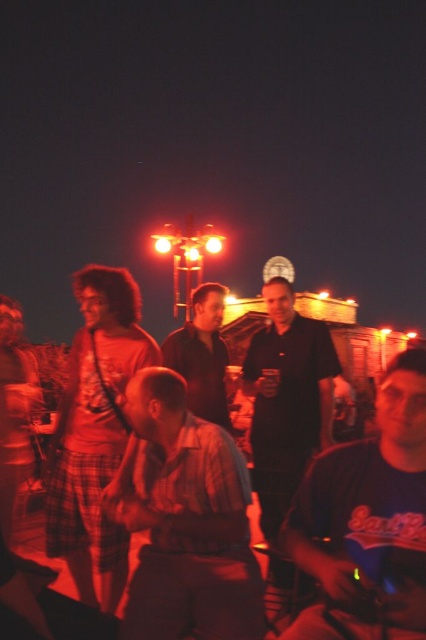
Which is below, dark blue t-shirt at lower right or matte red shirt at center?

matte red shirt at center is lower down.

Is dark blue t-shirt at lower right in front of matte red shirt at center?

Yes, dark blue t-shirt at lower right is closer to the viewer.

Describe the element at coordinates (368, 522) in the screenshot. This screenshot has height=640, width=426. I see `dark blue t-shirt at lower right` at that location.

The image size is (426, 640). Identify the location of dark blue t-shirt at lower right. (368, 522).

Between matte red shirt at center and dark brown leather jacket at center, which one is positioned higher?

Positioned higher is dark brown leather jacket at center.

Between point (71, 548) and point (219, 364), which one is positioned behind?

Point (219, 364)

Describe the element at coordinates (94, 432) in the screenshot. I see `matte red shirt at center` at that location.

This screenshot has height=640, width=426. Find the location of `matte red shirt at center`. matte red shirt at center is located at coordinates (94, 432).

Between matte red shirt at center and matte black shirt at center, which one has more height?

With more height is matte red shirt at center.

Consider the image. Is matte red shirt at center in front of matte black shirt at center?

Yes, matte red shirt at center is in front of matte black shirt at center.

This screenshot has height=640, width=426. Identify the location of matte red shirt at center. (94, 432).